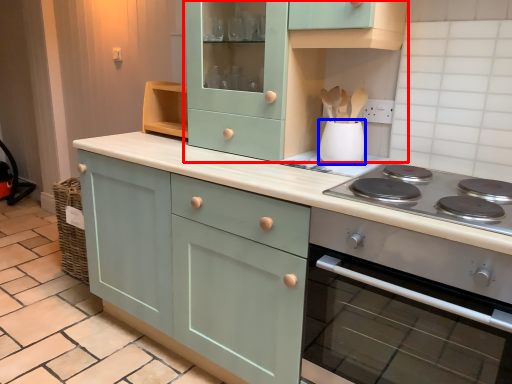
Question: Which point is closer to the camera, cabinetry (highlighted by a red box) or kitchen appliance (highlighted by a blue box)?

Choices:
 (A) cabinetry
 (B) kitchen appliance

Answer: (A)